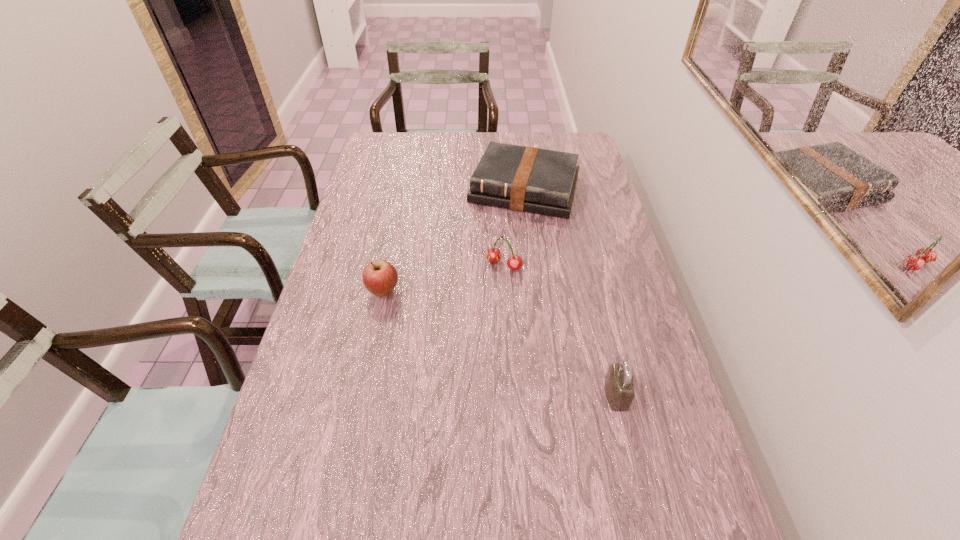
Where is `vacant space located 0.070m with stems pointing upwards on the cherry`? Image resolution: width=960 pixels, height=540 pixels. vacant space located 0.070m with stems pointing upwards on the cherry is located at coordinates (484, 288).

Where is `vacant space situated 0.400m on the spine side of the hardback book`? vacant space situated 0.400m on the spine side of the hardback book is located at coordinates (x=482, y=308).

I want to click on free spot located on the spine side of the hardback book, so click(x=508, y=233).

Identify the location of vacant space situated 0.380m on the spine side of the hardback book. (484, 302).

Find the location of a particular element. The width and height of the screenshot is (960, 540). object that is at the far edge is located at coordinates (526, 179).

Find the location of a particular element. Image resolution: width=960 pixels, height=540 pixels. object situated at the left edge is located at coordinates (380, 277).

Identify the location of padlock that is positioned at the right edge. (619, 385).

At what (x,y) coordinates should I click in order to perform the action: click on hardback book located in the right edge section of the desktop. Please return your answer as a coordinate pair (x, y). Image resolution: width=960 pixels, height=540 pixels. Looking at the image, I should click on (526, 179).

Locate an element on the screen. object that is at the far right corner is located at coordinates (526, 179).

I want to click on free space at the far edge, so click(x=428, y=138).